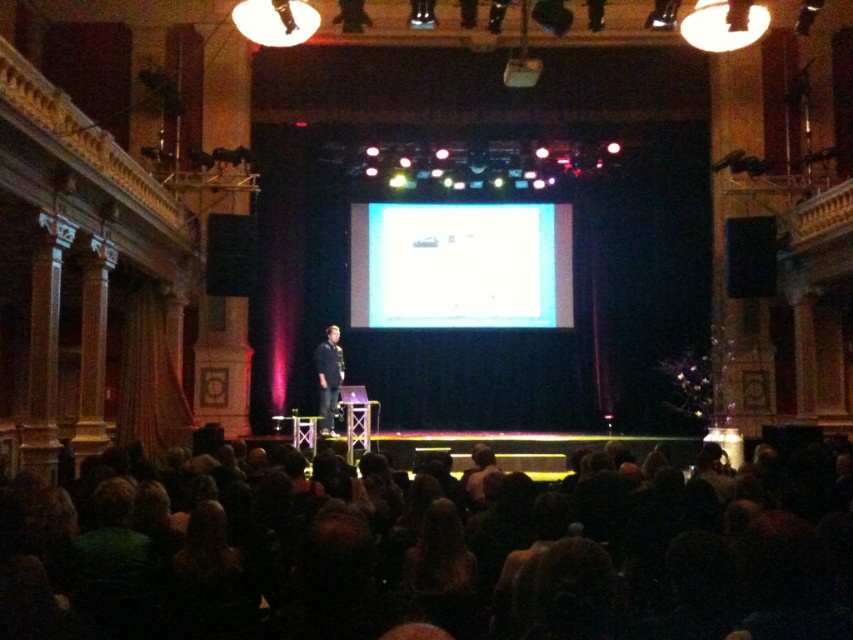
You are an attendee at the presentation and want to see the speaker clearly. Which object, the dark brown hair at lower center or the dark gray shirt at center, is easier to see from your seat in the audience?

The dark gray shirt at center is easier to see because it is larger in size compared to the dark brown hair at lower center.

You are an attendee at the presentation. You notice the speaker has two distinct features visible from your seat. Which feature is closer to you, the dark brown hair at lower center or the dark gray shirt at center?

The dark brown hair at lower center is closer to you because it is in front of the dark gray shirt at center.